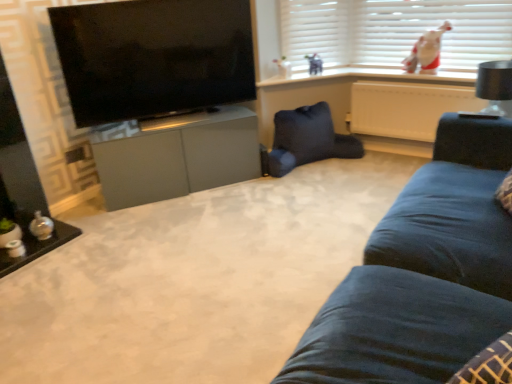
Question: Is white plush toy at upper right positioned behind black glossy tv at upper left?

Choices:
 (A) yes
 (B) no

Answer: (A)

Question: Considering the relative sizes of white plush toy at upper right and black glossy tv at upper left in the image provided, is white plush toy at upper right taller than black glossy tv at upper left?

Choices:
 (A) no
 (B) yes

Answer: (A)

Question: Could black glossy tv at upper left be considered to be inside white plush toy at upper right?

Choices:
 (A) no
 (B) yes

Answer: (A)

Question: Is black glossy tv at upper left at the back of white plush toy at upper right?

Choices:
 (A) yes
 (B) no

Answer: (B)

Question: Does white plush toy at upper right have a lesser width compared to black glossy tv at upper left?

Choices:
 (A) yes
 (B) no

Answer: (A)

Question: Does white plush toy at upper right appear on the right side of black glossy tv at upper left?

Choices:
 (A) no
 (B) yes

Answer: (B)

Question: Can you confirm if matte gray cabinet at center is bigger than dark blue fabric swivel chair at center?

Choices:
 (A) yes
 (B) no

Answer: (A)

Question: Can you confirm if matte gray cabinet at center is taller than dark blue fabric swivel chair at center?

Choices:
 (A) yes
 (B) no

Answer: (A)

Question: Is matte gray cabinet at center positioned with its back to dark blue fabric swivel chair at center?

Choices:
 (A) no
 (B) yes

Answer: (A)

Question: Is dark blue fabric swivel chair at center surrounded by matte gray cabinet at center?

Choices:
 (A) yes
 (B) no

Answer: (B)

Question: Is matte gray cabinet at center at the left side of dark blue fabric swivel chair at center?

Choices:
 (A) yes
 (B) no

Answer: (A)

Question: From the image's perspective, is matte gray cabinet at center under dark blue fabric swivel chair at center?

Choices:
 (A) yes
 (B) no

Answer: (A)

Question: Does black glossy tv at upper left have a lesser height compared to dark blue fabric swivel chair at center?

Choices:
 (A) yes
 (B) no

Answer: (B)